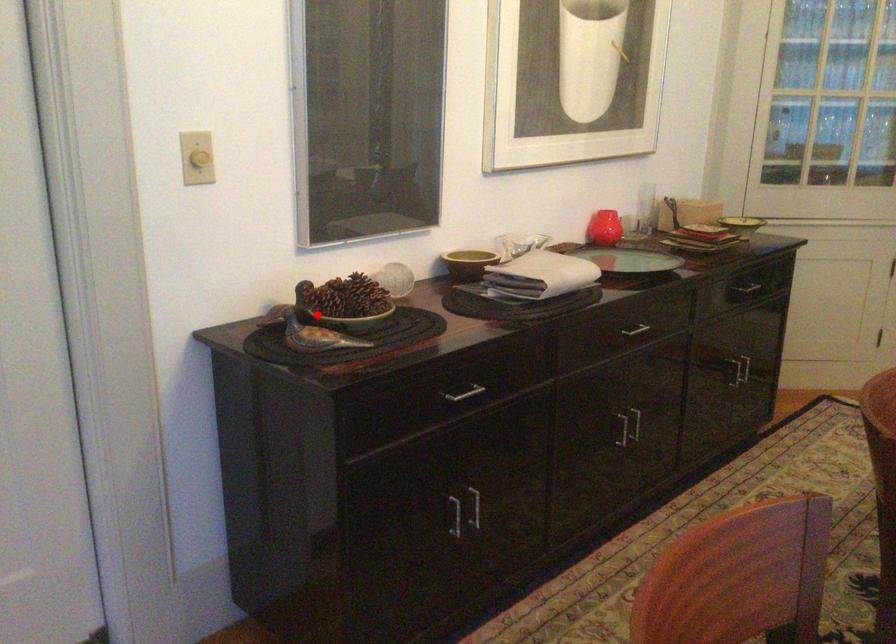
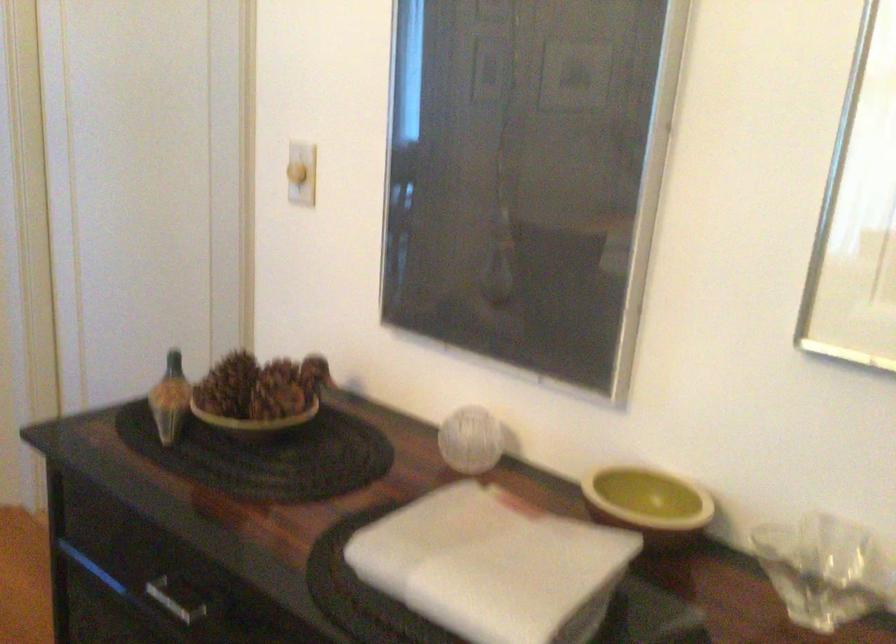
The point at the highlighted location is marked in the first image. Where is the corresponding point in the second image?

(169, 399)